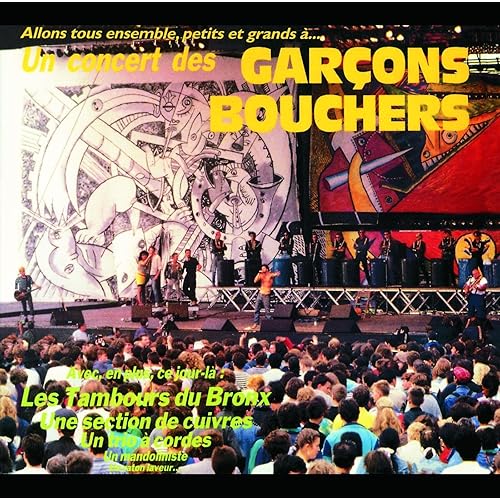
At what (x,y) coordinates should I click in order to perform the action: click on painting with red color. Please return your answer as a coordinate pair (x, y). Looking at the image, I should click on (444, 187).